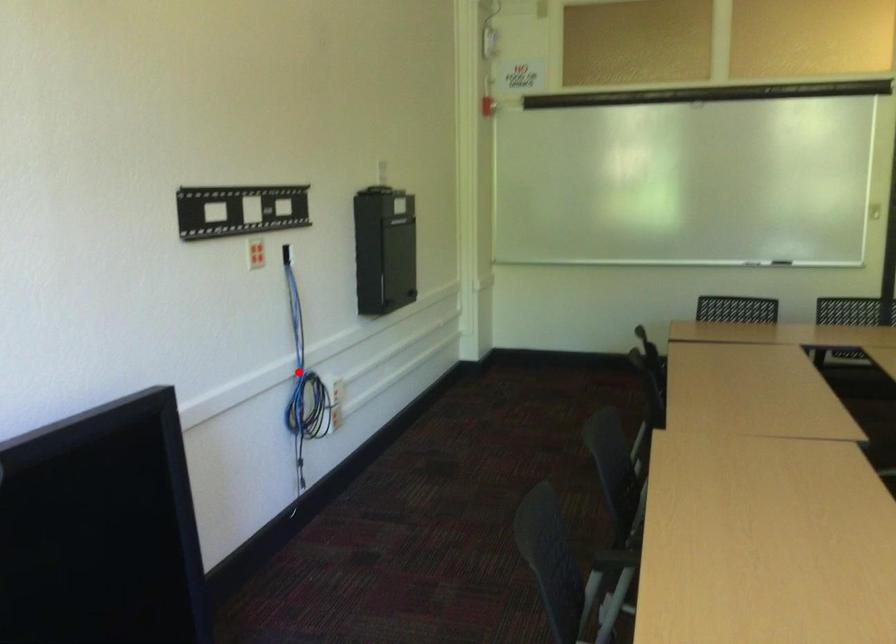
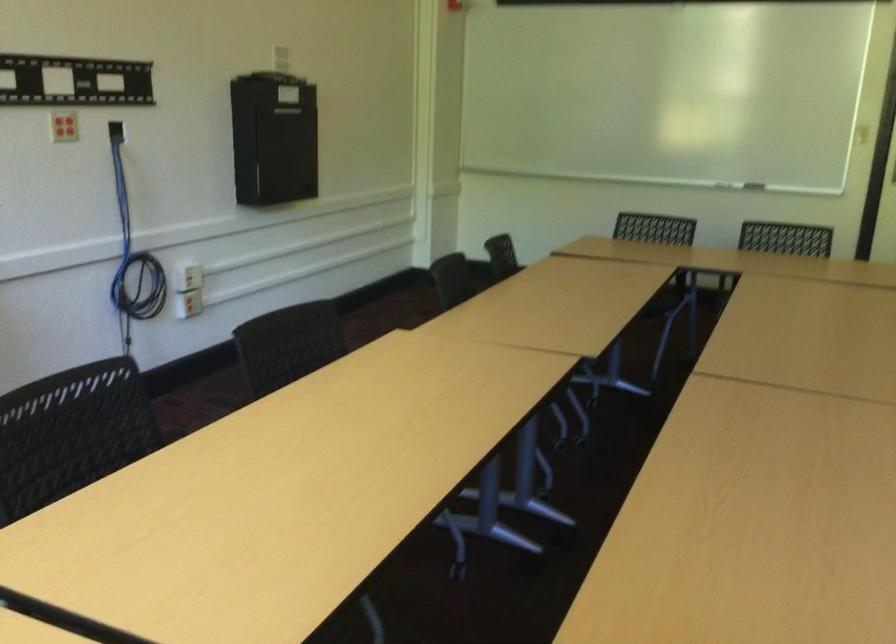
Where in the second image is the point corresponding to the highlighted location from the first image?

(133, 252)